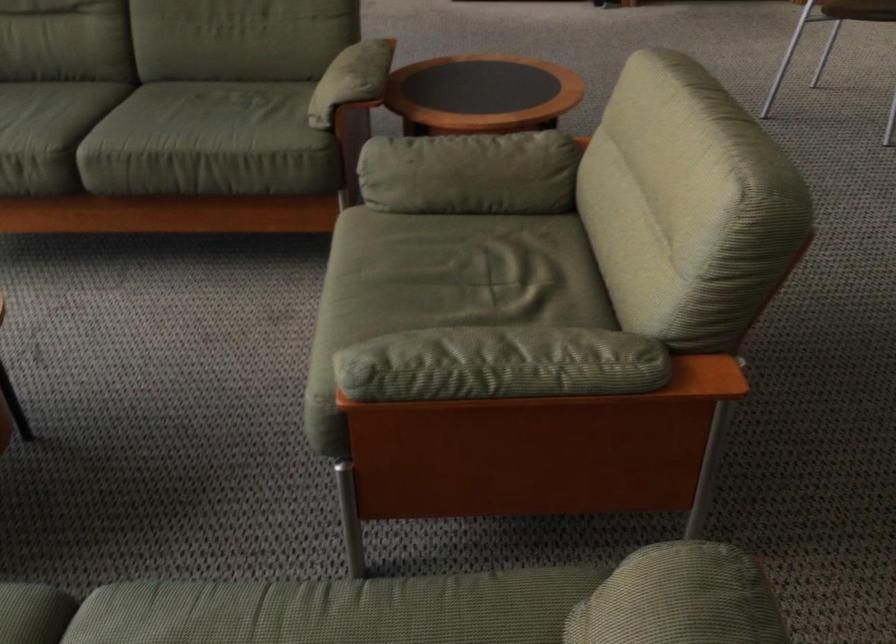
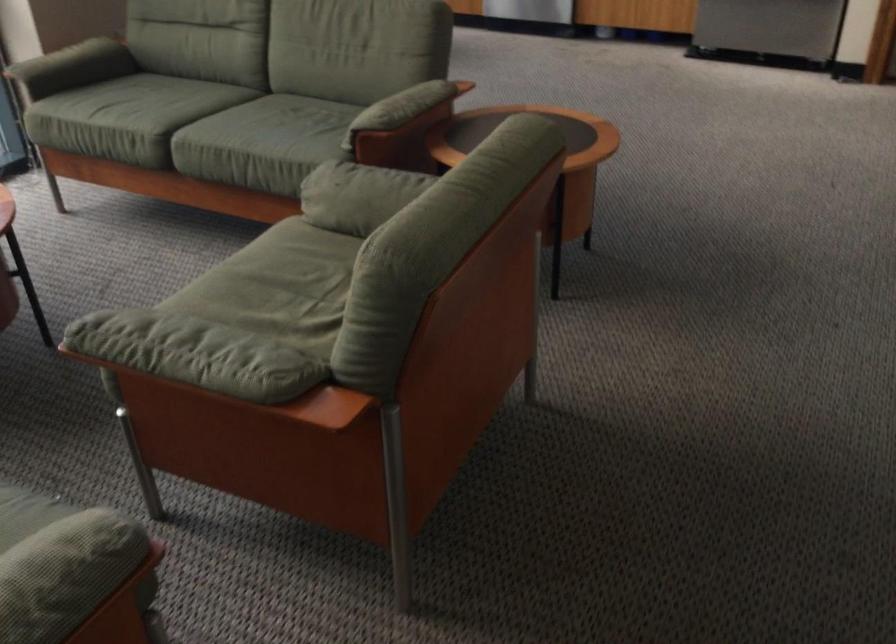
Question: The images are taken continuously from a first-person perspective. In which direction are you moving?

Choices:
 (A) Left
 (B) Right
 (C) Forward
 (D) Backward

Answer: (B)